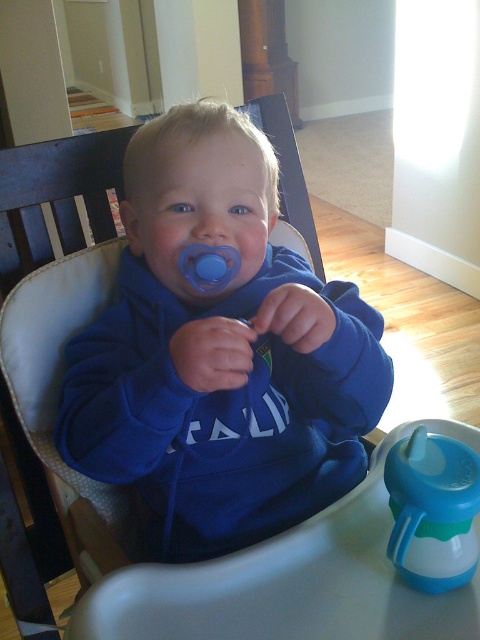
Question: Is blue fleece sweatshirt at center to the left of blue rubber sippy cup at lower right from the viewer's perspective?

Choices:
 (A) yes
 (B) no

Answer: (A)

Question: Which point is closer to the camera?

Choices:
 (A) blue fleece sweatshirt at center
 (B) blue rubber sippy cup at lower right

Answer: (B)

Question: Does blue fleece sweatshirt at center have a smaller size compared to blue rubber sippy cup at lower right?

Choices:
 (A) yes
 (B) no

Answer: (B)

Question: In this image, where is blue fleece sweatshirt at center located relative to blue rubber sippy cup at lower right?

Choices:
 (A) above
 (B) below

Answer: (A)

Question: Which point appears closest to the camera in this image?

Choices:
 (A) (340, 314)
 (B) (440, 436)

Answer: (B)

Question: Which point is farther to the camera?

Choices:
 (A) (108, 406)
 (B) (431, 433)

Answer: (B)